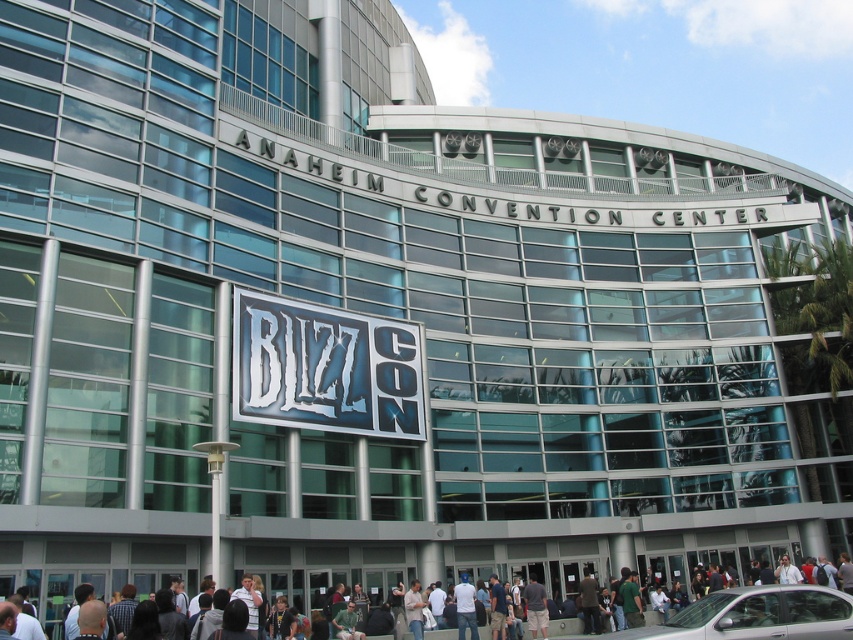
Can you confirm if silver metallic car at lower right is taller than dark blue shirt at lower center?

No, silver metallic car at lower right is not taller than dark blue shirt at lower center.

Who is more distant from viewer, (x=752, y=604) or (x=799, y=596)?

The point (x=799, y=596) is behind.

Image resolution: width=853 pixels, height=640 pixels. What do you see at coordinates (758, 616) in the screenshot? I see `silver metallic car at lower right` at bounding box center [758, 616].

Identify the location of silver metallic car at lower right. The image size is (853, 640). (758, 616).